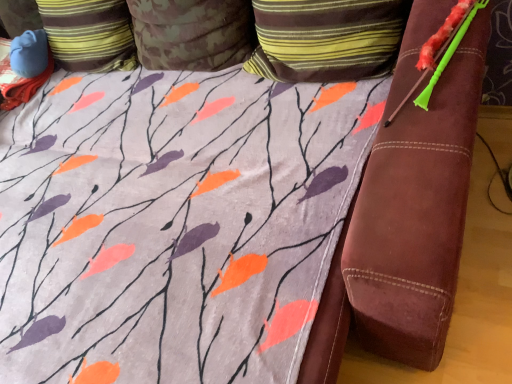
Question: Would you say striped fabric pillow at upper center, which appears as the third pillow when viewed from the left, is outside camouflage fabric pillow at upper center, which is counted as the second pillow, starting from the right?

Choices:
 (A) no
 (B) yes

Answer: (B)

Question: Is striped fabric pillow at upper center, which appears as the third pillow when viewed from the left, to the right of camouflage fabric pillow at upper center, which is counted as the second pillow, starting from the right, from the viewer's perspective?

Choices:
 (A) no
 (B) yes

Answer: (B)

Question: Does striped fabric pillow at upper center, arranged as the 1th pillow when viewed from the right, come in front of camouflage fabric pillow at upper center, arranged as the 2th pillow when viewed from the left?

Choices:
 (A) yes
 (B) no

Answer: (A)

Question: Could camouflage fabric pillow at upper center, which is counted as the second pillow, starting from the right, be considered to be inside striped fabric pillow at upper center, arranged as the 1th pillow when viewed from the right?

Choices:
 (A) no
 (B) yes

Answer: (A)

Question: From a real-world perspective, is striped fabric pillow at upper center, arranged as the 1th pillow when viewed from the right, physically above camouflage fabric pillow at upper center, arranged as the 2th pillow when viewed from the left?

Choices:
 (A) no
 (B) yes

Answer: (A)

Question: Visually, is camouflage fabric pillow at upper left, the third pillow in the right-to-left sequence, positioned to the left or to the right of striped fabric pillow at upper center, which appears as the third pillow when viewed from the left?

Choices:
 (A) left
 (B) right

Answer: (A)

Question: Does point (101, 46) appear closer or farther from the camera than point (369, 4)?

Choices:
 (A) farther
 (B) closer

Answer: (A)

Question: From a real-world perspective, is camouflage fabric pillow at upper left, the third pillow in the right-to-left sequence, above or below striped fabric pillow at upper center, arranged as the 1th pillow when viewed from the right?

Choices:
 (A) above
 (B) below

Answer: (A)

Question: Looking at the image, does camouflage fabric pillow at upper left, the third pillow in the right-to-left sequence, seem bigger or smaller compared to striped fabric pillow at upper center, which appears as the third pillow when viewed from the left?

Choices:
 (A) big
 (B) small

Answer: (A)

Question: From a real-world perspective, is striped fabric pillow at upper center, which appears as the third pillow when viewed from the left, above or below camouflage fabric pillow at upper left, the third pillow in the right-to-left sequence?

Choices:
 (A) above
 (B) below

Answer: (B)

Question: Considering the relative positions of striped fabric pillow at upper center, which appears as the third pillow when viewed from the left, and camouflage fabric pillow at upper left, arranged as the 1th pillow when viewed from the left, in the image provided, is striped fabric pillow at upper center, which appears as the third pillow when viewed from the left, to the left or to the right of camouflage fabric pillow at upper left, arranged as the 1th pillow when viewed from the left,?

Choices:
 (A) left
 (B) right

Answer: (B)

Question: Is point (260, 3) positioned closer to the camera than point (70, 11)?

Choices:
 (A) farther
 (B) closer

Answer: (B)

Question: Is striped fabric pillow at upper center, arranged as the 1th pillow when viewed from the right, bigger or smaller than camouflage fabric pillow at upper left, the third pillow in the right-to-left sequence?

Choices:
 (A) small
 (B) big

Answer: (A)

Question: From a real-world perspective, is camouflage fabric pillow at upper center, arranged as the 2th pillow when viewed from the left, physically located above or below camouflage fabric pillow at upper left, arranged as the 1th pillow when viewed from the left?

Choices:
 (A) above
 (B) below

Answer: (B)

Question: Would you say camouflage fabric pillow at upper center, arranged as the 2th pillow when viewed from the left, is inside or outside camouflage fabric pillow at upper left, arranged as the 1th pillow when viewed from the left?

Choices:
 (A) outside
 (B) inside

Answer: (A)